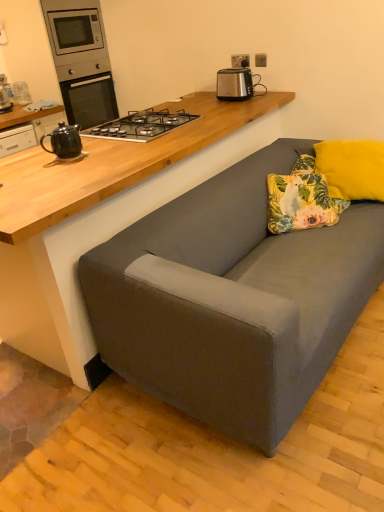
Question: From the image's perspective, is brushed metal microwave at upper left on top of black ceramic teapot at left?

Choices:
 (A) no
 (B) yes

Answer: (B)

Question: From a real-world perspective, is brushed metal microwave at upper left physically above black ceramic teapot at left?

Choices:
 (A) yes
 (B) no

Answer: (A)

Question: Does brushed metal microwave at upper left have a smaller size compared to black ceramic teapot at left?

Choices:
 (A) no
 (B) yes

Answer: (A)

Question: Does brushed metal microwave at upper left have a lesser height compared to black ceramic teapot at left?

Choices:
 (A) yes
 (B) no

Answer: (B)

Question: Is brushed metal microwave at upper left not near black ceramic teapot at left?

Choices:
 (A) yes
 (B) no

Answer: (A)

Question: Is yellow fluffy pillow at upper right, arranged as the second pillow when viewed from the left, in front of or behind satin silver toaster at upper center in the image?

Choices:
 (A) behind
 (B) front

Answer: (B)

Question: Is point (367, 183) closer or farther from the camera than point (218, 75)?

Choices:
 (A) farther
 (B) closer

Answer: (B)

Question: From the image's perspective, is yellow fluffy pillow at upper right, arranged as the second pillow when viewed from the left, positioned above or below satin silver toaster at upper center?

Choices:
 (A) above
 (B) below

Answer: (B)

Question: Is yellow fluffy pillow at upper right, arranged as the second pillow when viewed from the left, taller or shorter than satin silver toaster at upper center?

Choices:
 (A) tall
 (B) short

Answer: (A)

Question: From a real-world perspective, relative to brushed metal microwave at upper left, is floral fabric pillow at center, acting as the 2th pillow starting from the right, vertically above or below?

Choices:
 (A) above
 (B) below

Answer: (B)

Question: Considering the positions of floral fabric pillow at center, which is the 1th pillow from left to right, and brushed metal microwave at upper left in the image, is floral fabric pillow at center, which is the 1th pillow from left to right, bigger or smaller than brushed metal microwave at upper left?

Choices:
 (A) small
 (B) big

Answer: (A)

Question: Considering their positions, is floral fabric pillow at center, acting as the 2th pillow starting from the right, located in front of or behind brushed metal microwave at upper left?

Choices:
 (A) front
 (B) behind

Answer: (A)

Question: Is floral fabric pillow at center, acting as the 2th pillow starting from the right, inside the boundaries of brushed metal microwave at upper left, or outside?

Choices:
 (A) outside
 (B) inside

Answer: (A)

Question: Considering the positions of satin silver toaster at upper center and yellow fluffy pillow at upper right, acting as the first pillow starting from the right, in the image, is satin silver toaster at upper center bigger or smaller than yellow fluffy pillow at upper right, acting as the first pillow starting from the right,?

Choices:
 (A) small
 (B) big

Answer: (A)

Question: From the image's perspective, is satin silver toaster at upper center above or below yellow fluffy pillow at upper right, arranged as the second pillow when viewed from the left?

Choices:
 (A) above
 (B) below

Answer: (A)